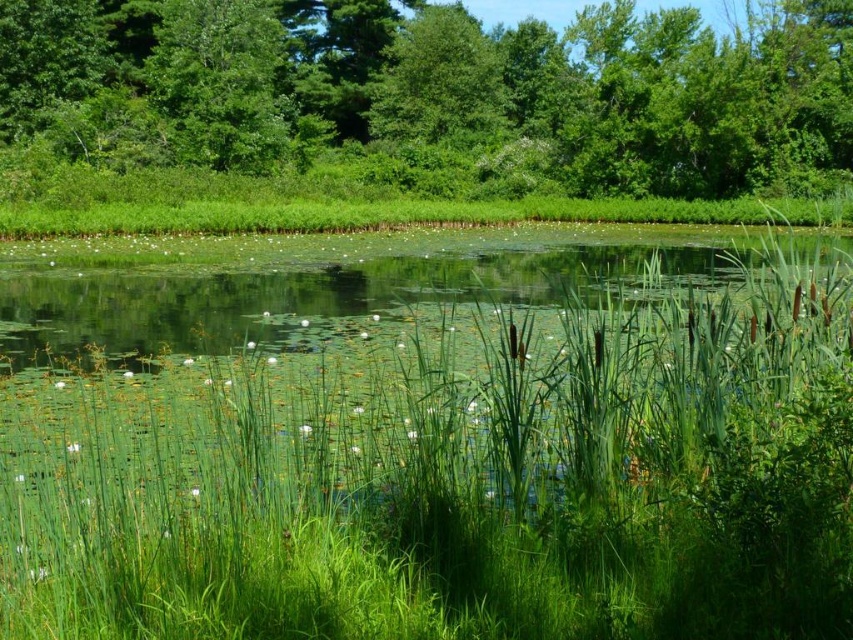
Who is more forward, [502,429] or [212,61]?

Point [502,429] is more forward.

Does green grass at center lie in front of green leafy tree at upper center?

Yes, it is in front of green leafy tree at upper center.

Is point (489, 426) more distant than point (798, 81)?

No, (489, 426) is in front of (798, 81).

You are a GUI agent. You are given a task and a screenshot of the screen. Output one action in this format:
    pyautogui.click(x=<x>, y=<y>)
    Task: Click on the green grass at center
    
    Given the screenshot: What is the action you would take?
    pyautogui.click(x=434, y=440)